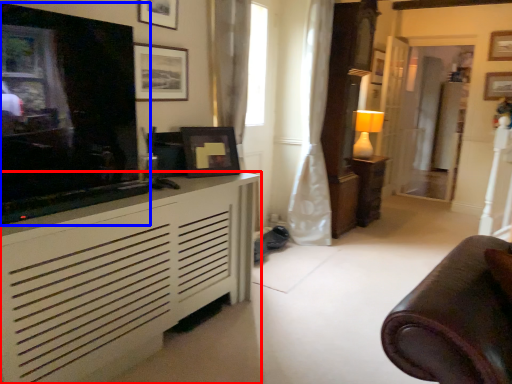
Question: Which of the following is the closest to the observer, cabinetry (highlighted by a red box) or television (highlighted by a blue box)?

Choices:
 (A) cabinetry
 (B) television

Answer: (A)